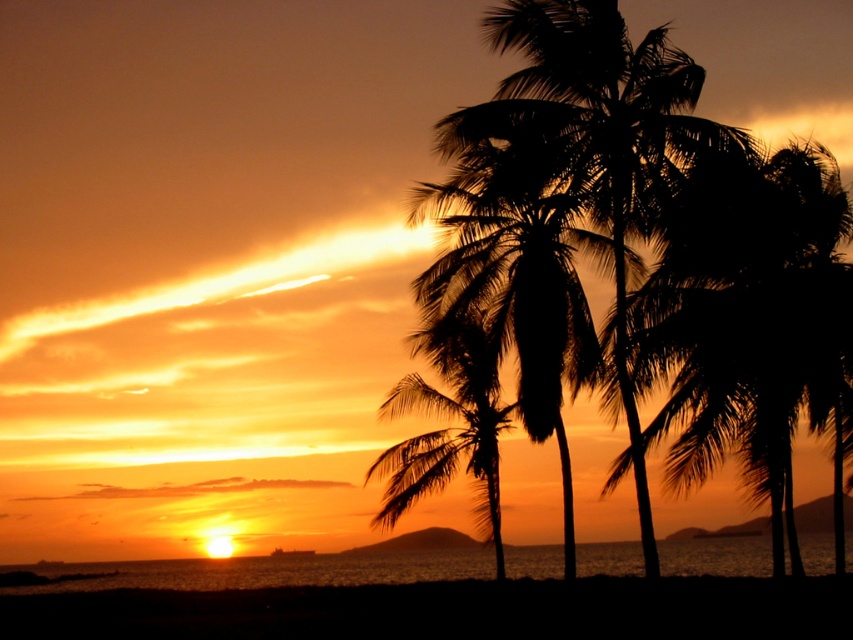
Question: Is silhouette palm trees at right above silhouette palm trees at center?

Choices:
 (A) yes
 (B) no

Answer: (A)

Question: Among these objects, which one is nearest to the camera?

Choices:
 (A) silhouette leafy palm at center
 (B) black silhouette coconut tree at right

Answer: (B)

Question: Does transparent water at lower center have a lesser width compared to silhouette leafy palm at center?

Choices:
 (A) no
 (B) yes

Answer: (A)

Question: Does silhouette palm trees at right have a larger size compared to silhouette palm trees at center?

Choices:
 (A) no
 (B) yes

Answer: (B)

Question: Among these points, which one is farthest from the camera?

Choices:
 (A) (625, 561)
 (B) (508, 422)

Answer: (A)

Question: Which object is farther from the camera taking this photo?

Choices:
 (A) transparent water at lower center
 (B) silhouette leafy palm at center
 (C) silhouette palm trees at center

Answer: (A)